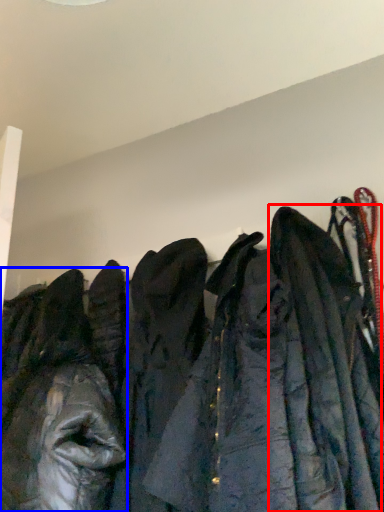
Question: Which of the following is the farthest to the observer, cloak (highlighted by a red box) or jacket (highlighted by a blue box)?

Choices:
 (A) cloak
 (B) jacket

Answer: (B)